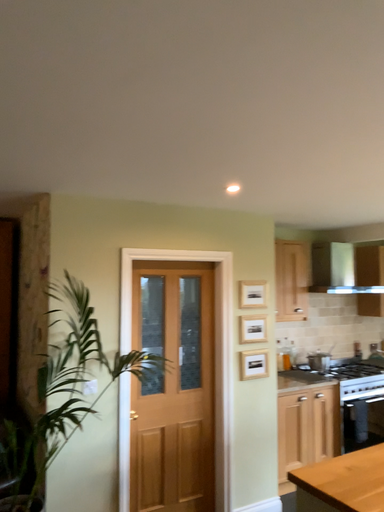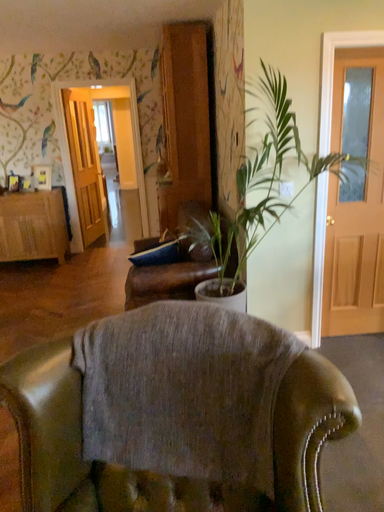
Question: Which way did the camera rotate in the video?

Choices:
 (A) rotated upward
 (B) rotated downward

Answer: (B)